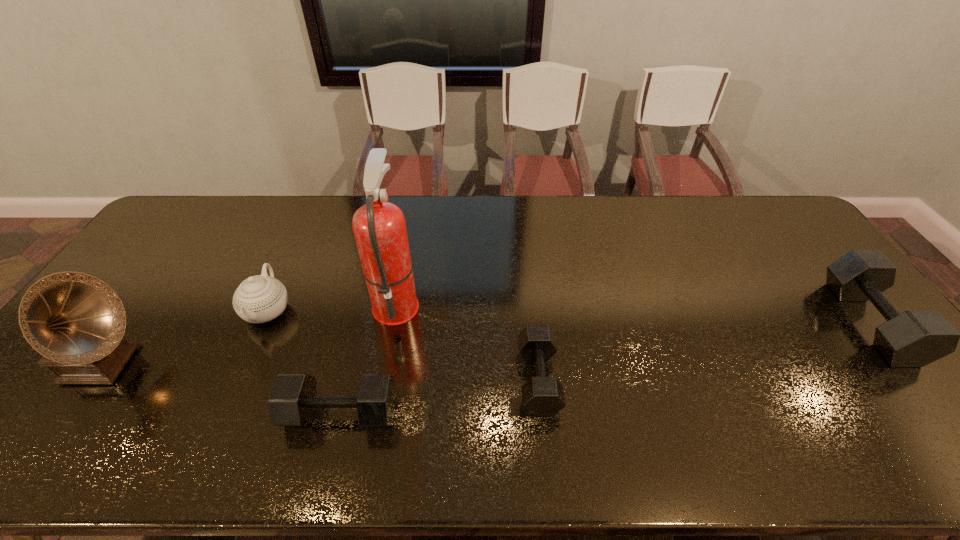
At what (x,y) coordinates should I click in order to perform the action: click on the leftmost dumbbell. Please return your answer as a coordinate pair (x, y). Looking at the image, I should click on (293, 399).

This screenshot has width=960, height=540. Identify the location of the second shortest dumbbell. pos(293,399).

Where is `the shortest dumbbell`? The width and height of the screenshot is (960, 540). the shortest dumbbell is located at coordinates (542, 395).

Where is `the second dumbbell from right to left`? This screenshot has height=540, width=960. the second dumbbell from right to left is located at coordinates (542, 395).

The height and width of the screenshot is (540, 960). Identify the location of the rightmost object. (913, 338).

Where is `the tallest dumbbell`? the tallest dumbbell is located at coordinates (913, 338).

This screenshot has height=540, width=960. I want to click on the second object from left to right, so click(258, 299).

The image size is (960, 540). Identify the location of fire extinguisher. (379, 227).

This screenshot has width=960, height=540. Identify the location of the leftmost object. (77, 322).

Locate an element on the screen. This screenshot has width=960, height=540. the second tallest object is located at coordinates (77, 322).